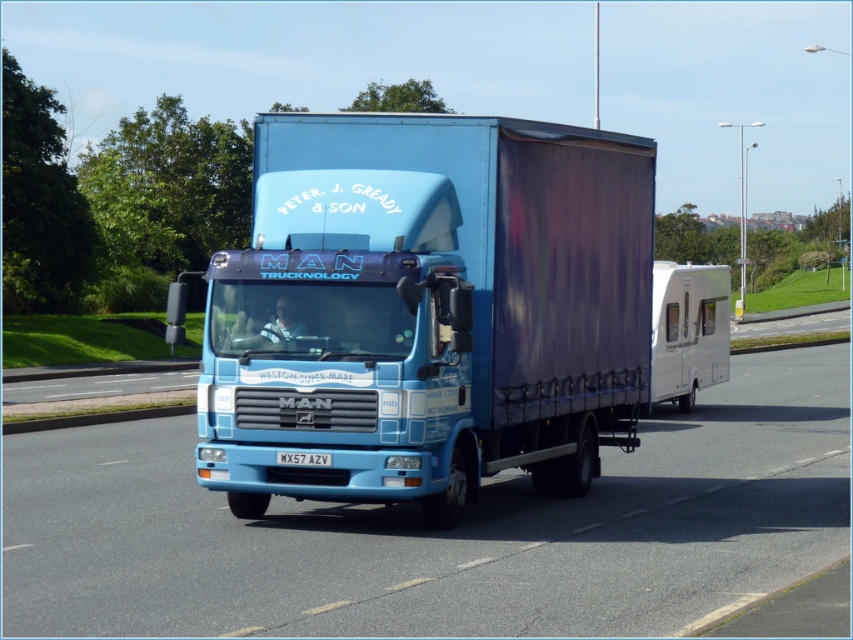
You are a photographer standing at a safe distance from the blue glossy trailer truck at center. You want to capture a photo of it without any distortion. Considering the truck is 8.48 meters away from you, what is the minimum distance you should maintain to ensure the photo is distortion free?

To capture a distortion free photo of the blue glossy trailer truck at center, you should maintain a distance of at least 8.48 meters or more. Since the truck is already 8.48 meters away, staying at that distance or further back will help minimize distortion.

You are a driver looking at the truck from the front. Can you see the white glossy caravan at right above the white plastic license plate at center?

Yes, the white glossy caravan at right is located above the white plastic license plate at center, so you can see it from the front.

You are standing at the point marked by the coordinates (438, 531). Based on the scene described, what object are you directly facing?

The point marked by the coordinates (438, 531) marks the blue glossy truck at center, so you are directly facing the blue glossy truck at center.